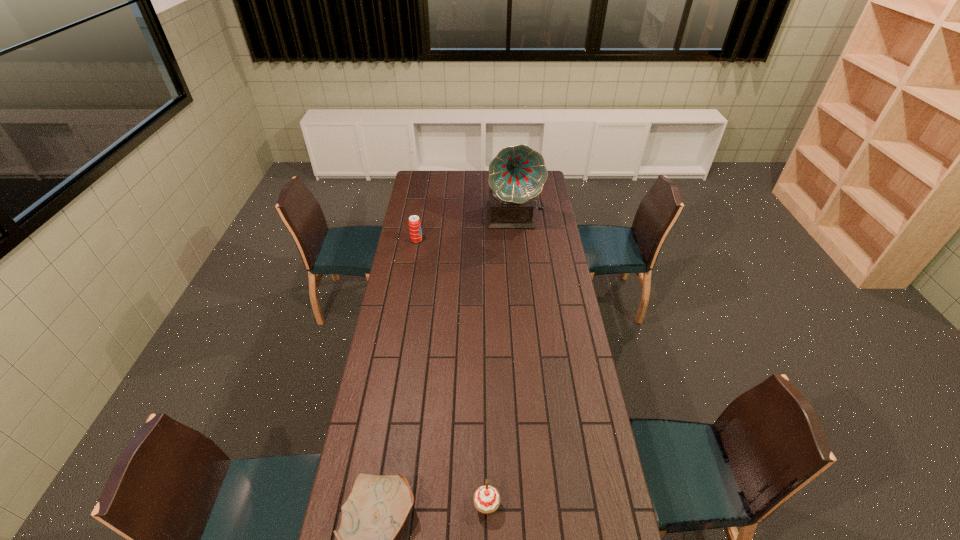
Where is `the farthest object`? the farthest object is located at coordinates (517, 174).

The image size is (960, 540). What are the coordinates of `the tallest object` in the screenshot? It's located at (517, 174).

This screenshot has width=960, height=540. What are the coordinates of `the second tallest object` in the screenshot? It's located at (414, 222).

Identify the location of soda can. (414, 222).

This screenshot has width=960, height=540. What are the coordinates of `the second shortest object` in the screenshot? It's located at (486, 498).

At what (x,y) coordinates should I click in order to perform the action: click on free space located 0.080m on the horn of the farthest object. Please return your answer as a coordinate pair (x, y). This screenshot has width=960, height=540. Looking at the image, I should click on (516, 243).

At what (x,y) coordinates should I click in order to perform the action: click on blank space located on the back of the third nearest object. Please return your answer as a coordinate pair (x, y). The image size is (960, 540). Looking at the image, I should click on (422, 205).

Identify the location of free location located on the left of the third tallest object. (392, 505).

Image resolution: width=960 pixels, height=540 pixels. Identify the location of object that is at the left edge. (414, 222).

Locate an element on the screen. object that is at the right edge is located at coordinates (517, 174).